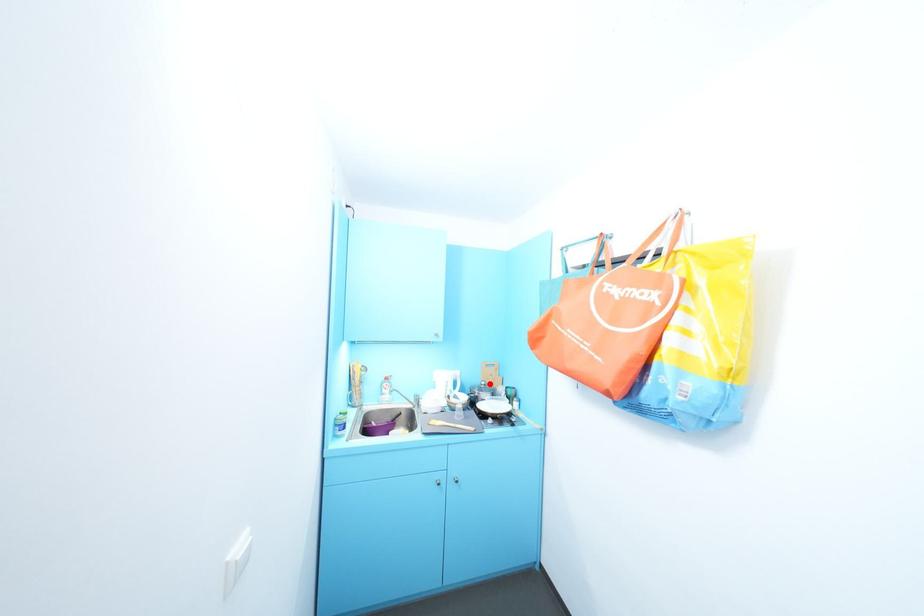
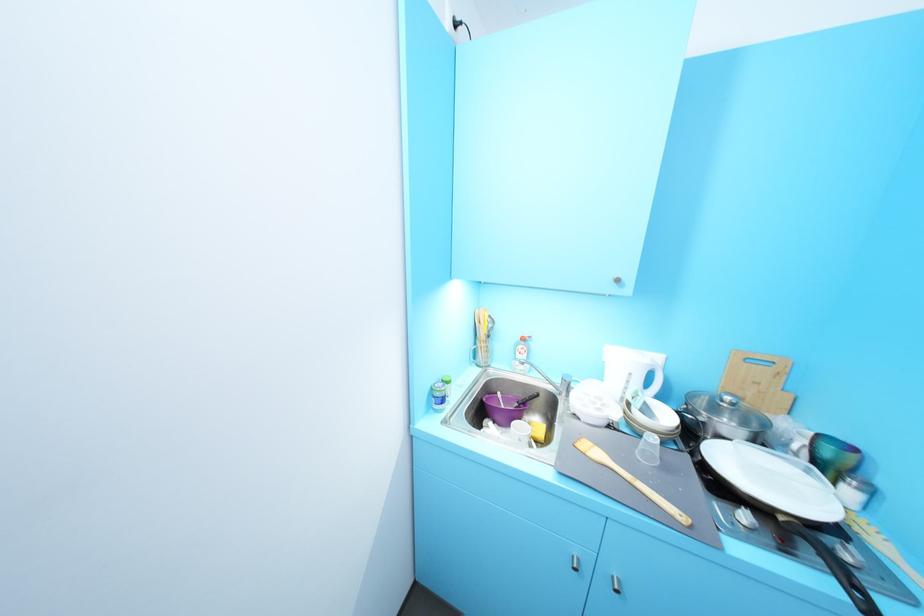
Where in the second image is the point corresponding to the highlighted location from the first image?

(735, 399)